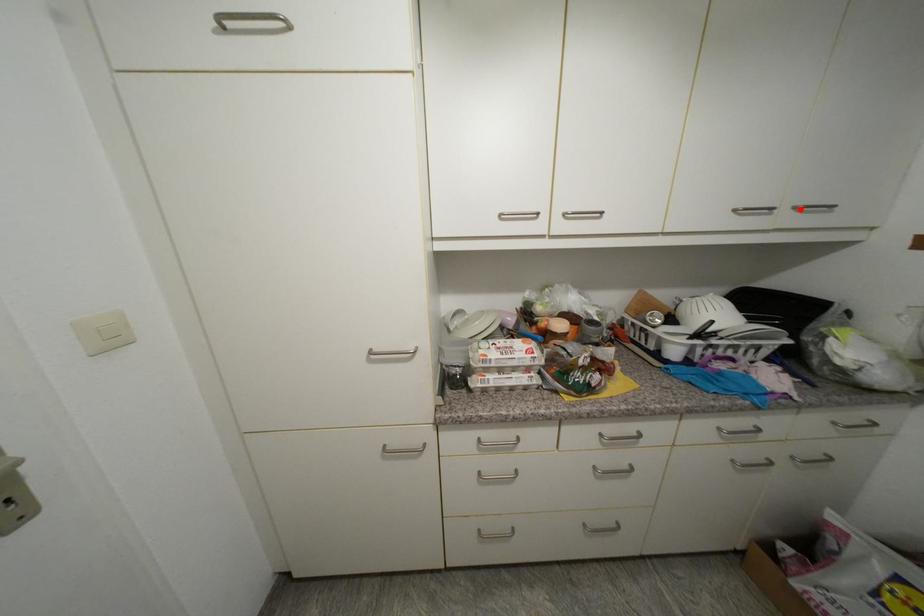
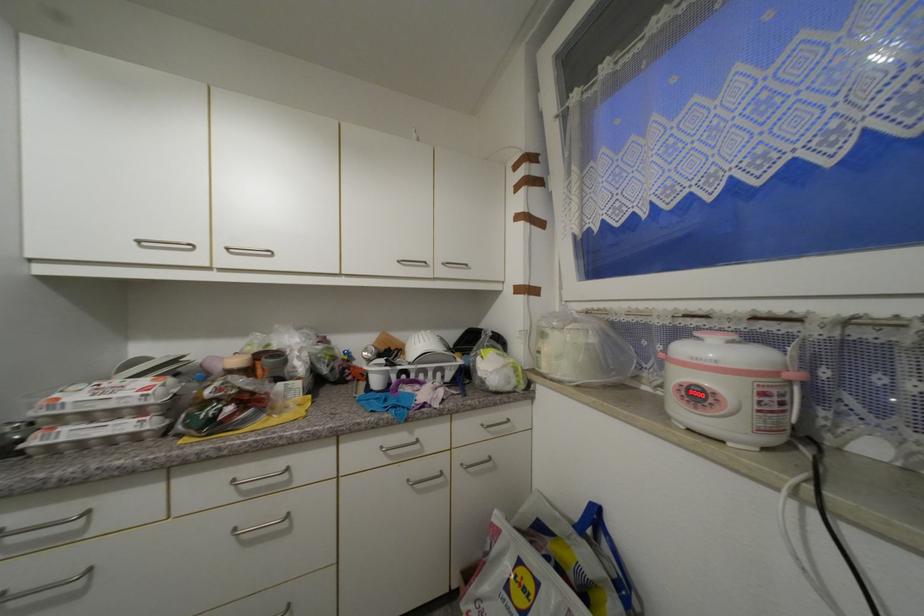
The point at the highlighted location is marked in the first image. Where is the corresponding point in the second image?

(448, 265)